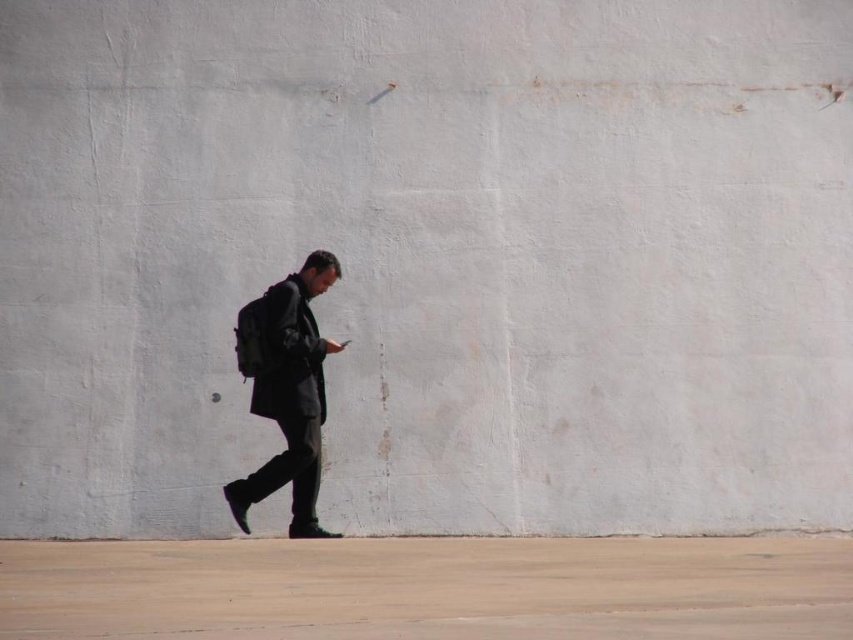
Question: Can you confirm if brown concrete pavement at lower center is wider than dark gray matte jacket at center?

Choices:
 (A) no
 (B) yes

Answer: (B)

Question: Does brown concrete pavement at lower center have a greater width compared to dark gray matte jacket at center?

Choices:
 (A) yes
 (B) no

Answer: (A)

Question: Which of the following is the closest to the observer?

Choices:
 (A) (277, 326)
 (B) (793, 625)

Answer: (B)

Question: Which object is farther from the camera taking this photo?

Choices:
 (A) brown concrete pavement at lower center
 (B) dark gray matte jacket at center

Answer: (B)

Question: Is brown concrete pavement at lower center thinner than dark gray matte jacket at center?

Choices:
 (A) yes
 (B) no

Answer: (B)